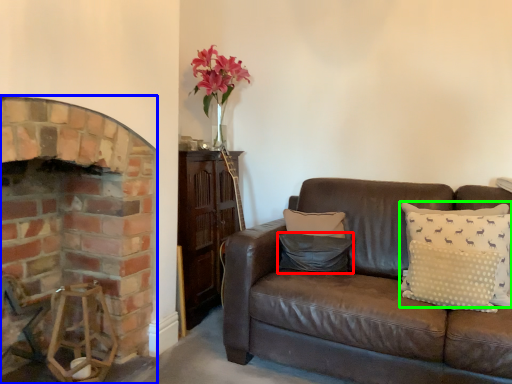
Question: Based on their relative distances, which object is nearer to pillow (highlighted by a red box)? Choose from fireplace (highlighted by a blue box) and pillow (highlighted by a green box).

Choices:
 (A) fireplace
 (B) pillow

Answer: (B)